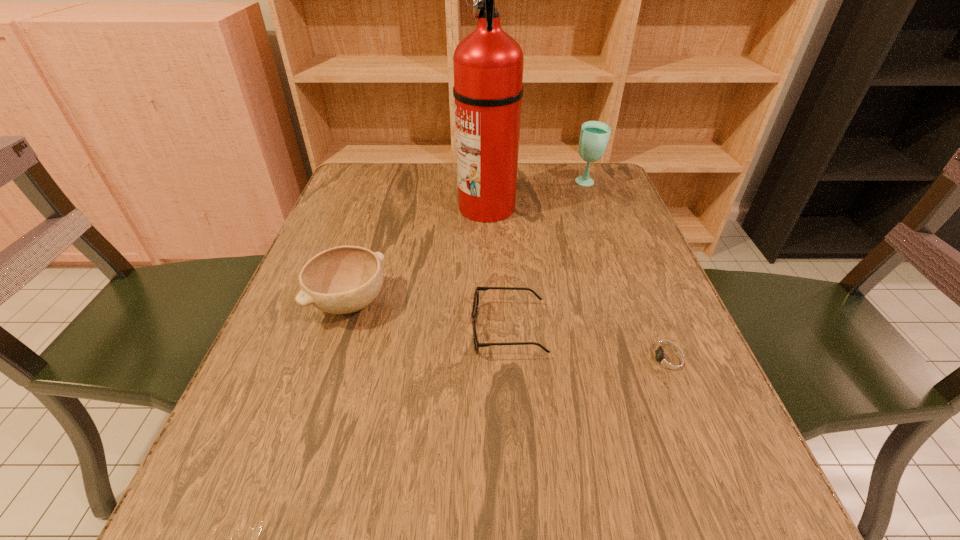
Find the location of a particular element. This screenshot has height=540, width=960. free space located 0.180m on the right of the bowl is located at coordinates (480, 303).

The width and height of the screenshot is (960, 540). Identify the location of vacant space located on the front-facing side of the second shortest object. (345, 330).

Where is `blank space located 0.050m on the front-facing side of the second shortest object`? blank space located 0.050m on the front-facing side of the second shortest object is located at coordinates (444, 330).

Image resolution: width=960 pixels, height=540 pixels. I want to click on vacant space located 0.190m on the front-facing side of the second shortest object, so click(367, 330).

Find the location of a particular element. The width and height of the screenshot is (960, 540). blank space located on the face of the watch is located at coordinates (420, 360).

You are a GUI agent. You are given a task and a screenshot of the screen. Output one action in this format:
    pyautogui.click(x=<x>, y=<y>)
    Task: Click on the free location located 0.100m on the face of the watch
    The width and height of the screenshot is (960, 540).
    Given the screenshot: What is the action you would take?
    pyautogui.click(x=580, y=360)

Where is `free space located 0.190m on the face of the watch`? The width and height of the screenshot is (960, 540). free space located 0.190m on the face of the watch is located at coordinates (527, 360).

You are a GUI agent. You are given a task and a screenshot of the screen. Output one action in this format:
    pyautogui.click(x=<x>, y=<y>)
    Task: Click on the fire extinguisher located in the far edge section of the desktop
    Image resolution: width=960 pixels, height=540 pixels.
    Given the screenshot: What is the action you would take?
    point(488,63)

The image size is (960, 540). Identify the location of glass present at the far edge. (594, 136).

Identify the location of object that is at the left edge. (344, 279).